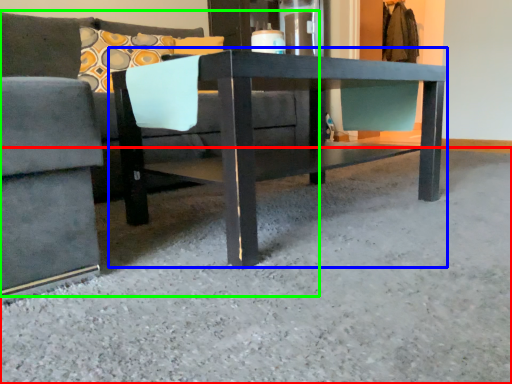
Question: Which object is the farthest from concrete (highlighted by a red box)? Choose among these: table (highlighted by a blue box) or studio couch (highlighted by a green box).

Choices:
 (A) table
 (B) studio couch

Answer: (B)